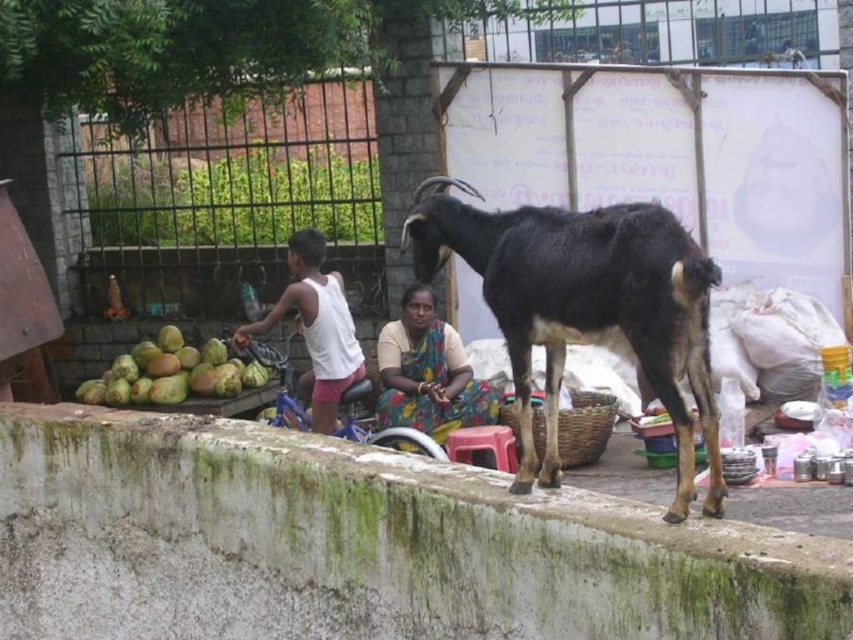
Question: Can you confirm if green mossy concrete at lower center is thinner than white cotton tank top at center?

Choices:
 (A) yes
 (B) no

Answer: (B)

Question: Where is white cotton tank top at center located in relation to green rough coconut at lower left in the image?

Choices:
 (A) below
 (B) above

Answer: (B)

Question: Which point appears farthest from the camera in this image?

Choices:
 (A) (173, 326)
 (B) (238, 337)

Answer: (A)

Question: Estimate the real-world distances between objects in this image. Which object is farther from the white cotton tank top at center?

Choices:
 (A) black fur goat at center
 (B) green rough coconut at lower left

Answer: (A)

Question: Is green mossy concrete at lower center bigger than brown woven basket at center?

Choices:
 (A) no
 (B) yes

Answer: (B)

Question: Which of the following is the farthest from the observer?

Choices:
 (A) (485, 465)
 (B) (340, 320)

Answer: (B)